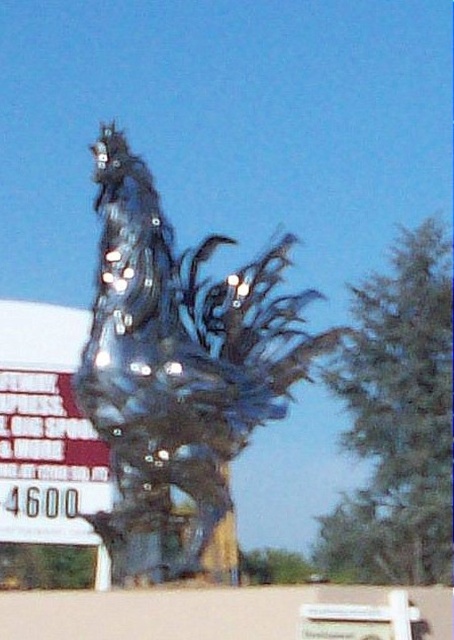
Who is positioned more to the left, glossy glass rooster at center or white paper sign at left?

white paper sign at left is more to the left.

Is the position of glossy glass rooster at center more distant than that of white paper sign at left?

No, glossy glass rooster at center is in front of white paper sign at left.

Describe the element at coordinates (178, 374) in the screenshot. The image size is (454, 640). I see `glossy glass rooster at center` at that location.

The image size is (454, 640). Identify the location of glossy glass rooster at center. (178, 374).